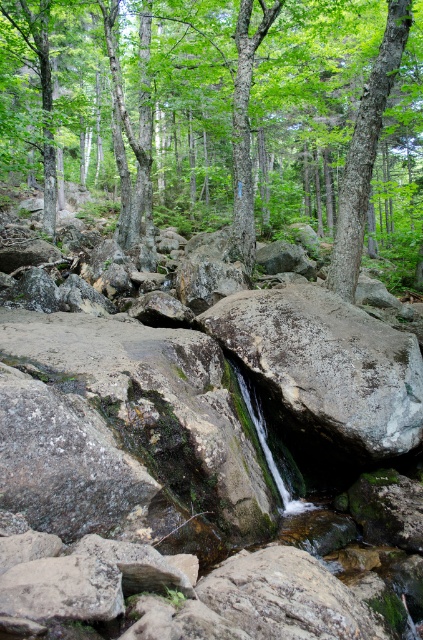
Question: Which point is farther to the camera?

Choices:
 (A) (392, 400)
 (B) (151, 637)
 (C) (353, 244)

Answer: (C)

Question: Among these points, which one is nearest to the camera?

Choices:
 (A) (110, 582)
 (B) (346, 115)
 (C) (408, 13)

Answer: (A)

Question: Observing the image, what is the correct spatial positioning of green leafy tree at center in reference to gray rough rock at center?

Choices:
 (A) above
 (B) below

Answer: (A)

Question: Considering the relative positions of gray rough rock at center and smooth bark tree at upper center in the image provided, where is gray rough rock at center located with respect to smooth bark tree at upper center?

Choices:
 (A) above
 (B) below

Answer: (B)

Question: Is green leafy tree at center to the right of smooth bark tree at upper center from the viewer's perspective?

Choices:
 (A) no
 (B) yes

Answer: (A)

Question: Based on their relative distances, which object is farther from the green leafy tree at center?

Choices:
 (A) green mossy rock at center
 (B) gray rough rock at center

Answer: (A)